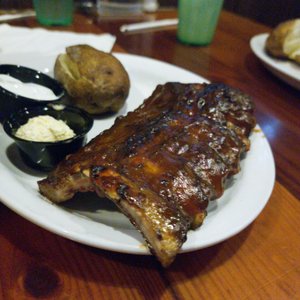
You are a GUI agent. You are given a task and a screenshot of the screen. Output one action in this format:
    pyautogui.click(x=<x>, y=<y>)
    Task: Click on the metal spoon
    This screenshot has width=300, height=300.
    Given the screenshot: What is the action you would take?
    pyautogui.click(x=147, y=7)